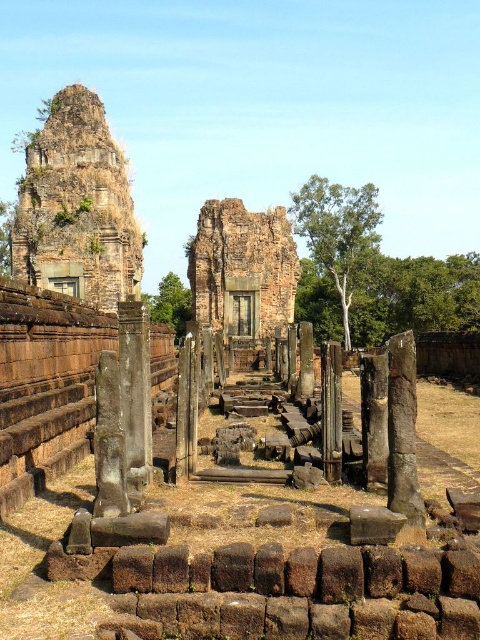
In the scene shown: Measure the distance between rusty stone tower at upper left and brown stone pillar at center.

rusty stone tower at upper left and brown stone pillar at center are 59.67 meters apart from each other.

Between point (50, 269) and point (122, 404), which one is positioned in front?

Point (122, 404) is in front.

You are a GUI agent. You are given a task and a screenshot of the screen. Output one action in this format:
    pyautogui.click(x=<x>, y=<y>)
    Task: Click on the rusty stone tower at upper left
    
    Given the screenshot: What is the action you would take?
    pyautogui.click(x=76, y=208)

Can you confirm if brown stone ruins at center is bigger than brown stone pillar at center?

Correct, brown stone ruins at center is larger in size than brown stone pillar at center.

Does brown stone ruins at center come in front of brown stone pillar at center?

No.

Identify the location of brown stone ruins at center. (242, 268).

Can you confirm if smooth stone pillar at center is positioned above brown stone pillar at center?

No.

Between point (387, 355) and point (134, 317), which one is positioned behind?

Point (134, 317)

At what (x,y) coordinates should I click in order to perform the action: click on smooth stone pillar at center. Please return your answer as a coordinate pair (x, y). Looking at the image, I should click on (403, 429).